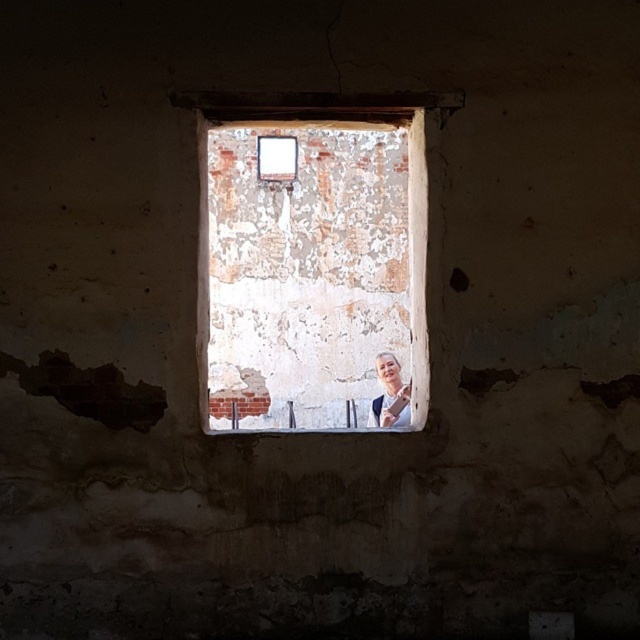
Who is lower down, white peeling paint at center or smooth beige woman at center?

smooth beige woman at center is below.

Does white peeling paint at center have a greater width compared to smooth beige woman at center?

Yes, white peeling paint at center is wider than smooth beige woman at center.

Between point (253, 124) and point (374, 406), which one is positioned in front?

Point (253, 124)

Image resolution: width=640 pixels, height=640 pixels. Find the location of `white peeling paint at center`. white peeling paint at center is located at coordinates (310, 262).